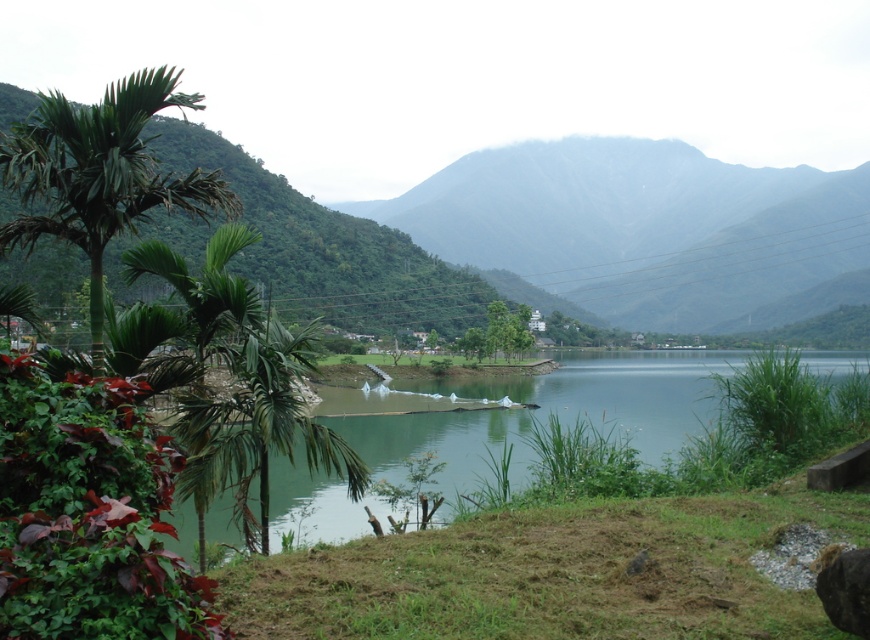
You are standing at the edge of the green grassy lake at center and want to reach the green matte mountain at center. Which direction should you head towards?

You should head to the right to reach the green matte mountain at center since it is located to the right of the green grassy lake at center.

You are a hiker standing at the edge of the green grassy lake at center. You want to take a photo of the green matte mountain at center. Which object should you focus on first to ensure both are in the frame?

The green matte mountain at center is much taller than the green grassy lake at center, so you should focus on the green matte mountain at center first to ensure it fits within the frame.

You are standing on the green leafy palm tree at left and want to reach the green grassy lake at center. Which direction should you move to get there?

The green grassy lake at center is bigger than the green leafy palm tree at left, but to determine the direction you need to move, you should head towards the center of the image where the lake is located.